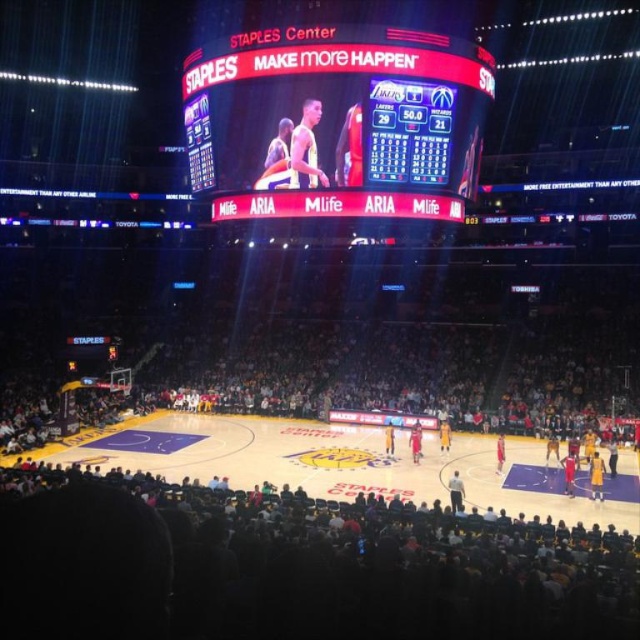
Question: Among these points, which one is farthest from the camera?

Choices:
 (A) (384, 74)
 (B) (276, 472)

Answer: (A)

Question: Is matte digital scoreboard at upper center below purple polished wood court at center?

Choices:
 (A) no
 (B) yes

Answer: (A)

Question: Can you confirm if matte digital scoreboard at upper center is thinner than purple polished wood court at center?

Choices:
 (A) yes
 (B) no

Answer: (A)

Question: Which point appears farthest from the camera in this image?

Choices:
 (A) (342, 67)
 (B) (628, 460)

Answer: (B)

Question: Is matte digital scoreboard at upper center bigger than purple polished wood court at center?

Choices:
 (A) yes
 (B) no

Answer: (A)

Question: Which of the following is the farthest from the observer?

Choices:
 (A) purple polished wood court at center
 (B) matte digital scoreboard at upper center

Answer: (B)